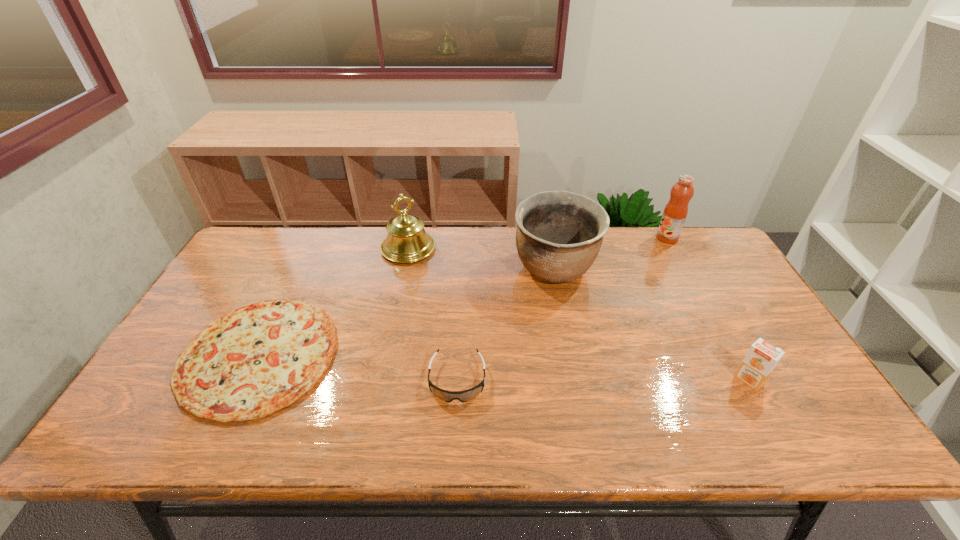
Where is `free space at the near right corner of the desktop`? The width and height of the screenshot is (960, 540). free space at the near right corner of the desktop is located at coordinates [766, 427].

You are a GUI agent. You are given a task and a screenshot of the screen. Output one action in this format:
    pyautogui.click(x=<x>, y=<y>)
    Task: Click on the blank region between the fourth tallest object and the fruit juice
    
    Given the screenshot: What is the action you would take?
    pyautogui.click(x=708, y=309)

The height and width of the screenshot is (540, 960). What are the coordinates of `free space that is in between the third object from left to right and the fruit juice` in the screenshot? It's located at (563, 309).

Find the location of a particular element. Image resolution: width=960 pixels, height=540 pixels. free area in between the fruit juice and the fifth tallest object is located at coordinates (563, 309).

This screenshot has width=960, height=540. I want to click on free space between the fruit juice and the fifth tallest object, so tap(563, 309).

Identify the location of free area in between the fifth tallest object and the fourth tallest object. (603, 380).

Where is `free space between the fruit juice and the orange juice`? free space between the fruit juice and the orange juice is located at coordinates (708, 309).

Locate an element on the screen. The image size is (960, 540). free space between the third object from right to left and the fruit juice is located at coordinates (612, 253).

The image size is (960, 540). I want to click on vacant space that is in between the orange juice and the fruit juice, so click(x=708, y=309).

Where is `free spot between the fourth tallest object and the pizza`? free spot between the fourth tallest object and the pizza is located at coordinates (504, 368).